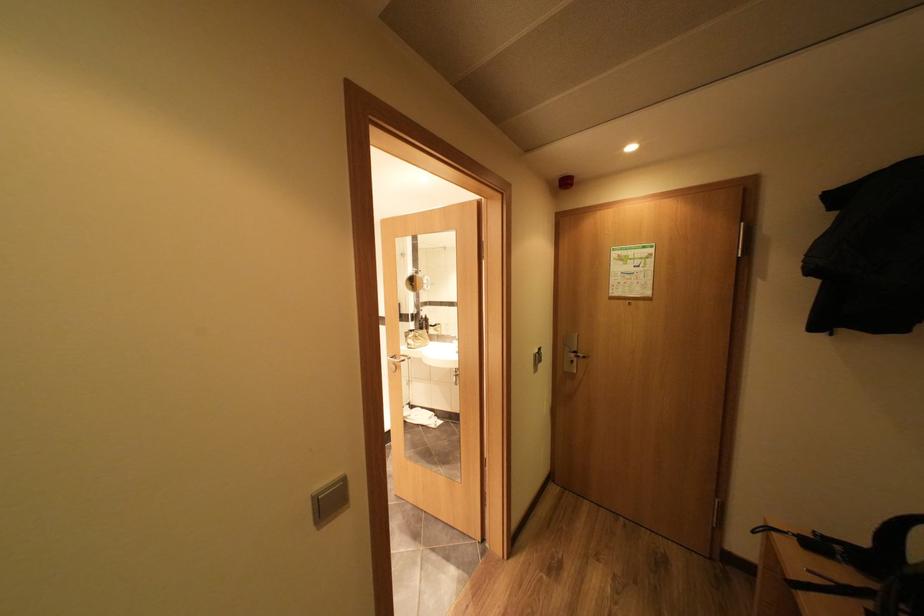
Find the location of a particular element. The image size is (924, 616). door peephole is located at coordinates (628, 299).